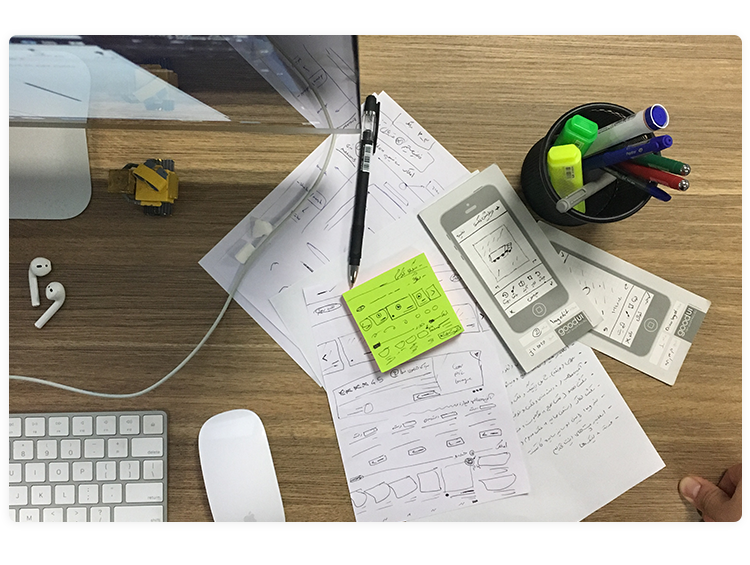
Image resolution: width=750 pixels, height=565 pixels. In order to click on cup in this screenshot , I will do `click(616, 215)`.